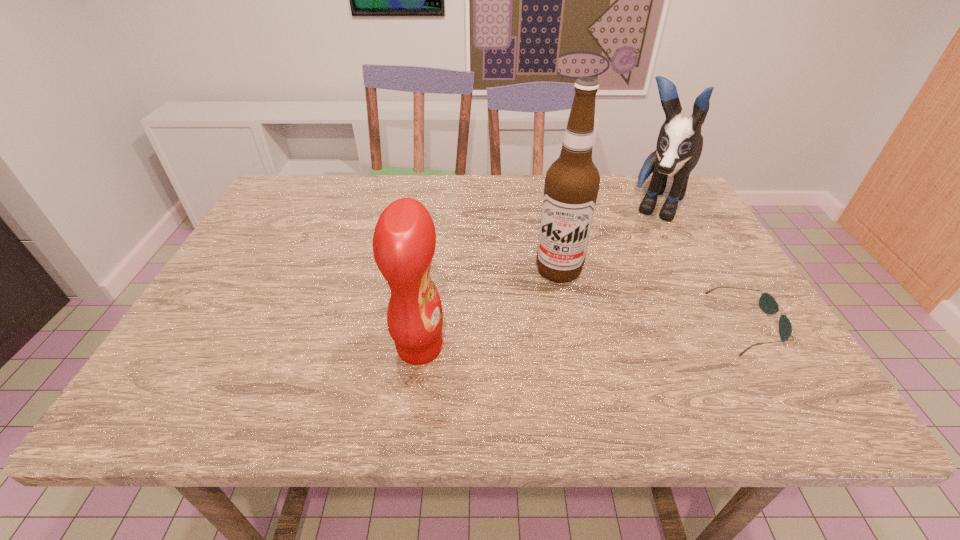
Identify the location of vacant point that satisfies the following two spatial constraints: 1. on the front side of the puppy; 2. on the lenses of the shortest object. (720, 325).